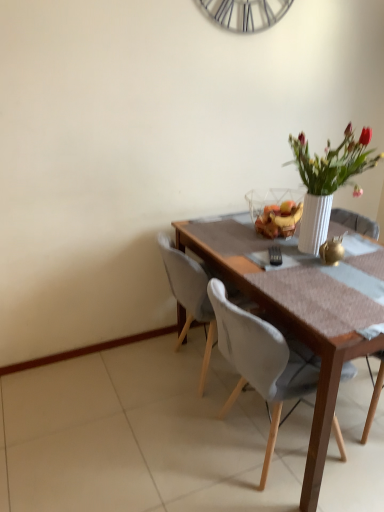
Question: Is point (360, 230) positioned closer to the camera than point (175, 294)?

Choices:
 (A) closer
 (B) farther

Answer: (B)

Question: Looking at their shapes, would you say wooden chair at right, which is the 1th chair in right-to-left order, is wider or thinner than white fabric chair at center, acting as the 1th chair starting from the left?

Choices:
 (A) thin
 (B) wide

Answer: (B)

Question: Based on their relative distances, which object is farther from the white fabric chair at center, acting as the 1th chair starting from the left?

Choices:
 (A) white fabric chair at center, which ranks as the 2th chair in left-to-right order
 (B) wooden chair at right, positioned as the third chair in left-to-right order

Answer: (B)

Question: Considering the real-world distances, which object is farthest from the white fabric chair at center, which ranks as the 2th chair in left-to-right order?

Choices:
 (A) white fabric chair at center, which is counted as the third chair, starting from the right
 (B) wooden chair at right, which is the 1th chair in right-to-left order

Answer: (B)